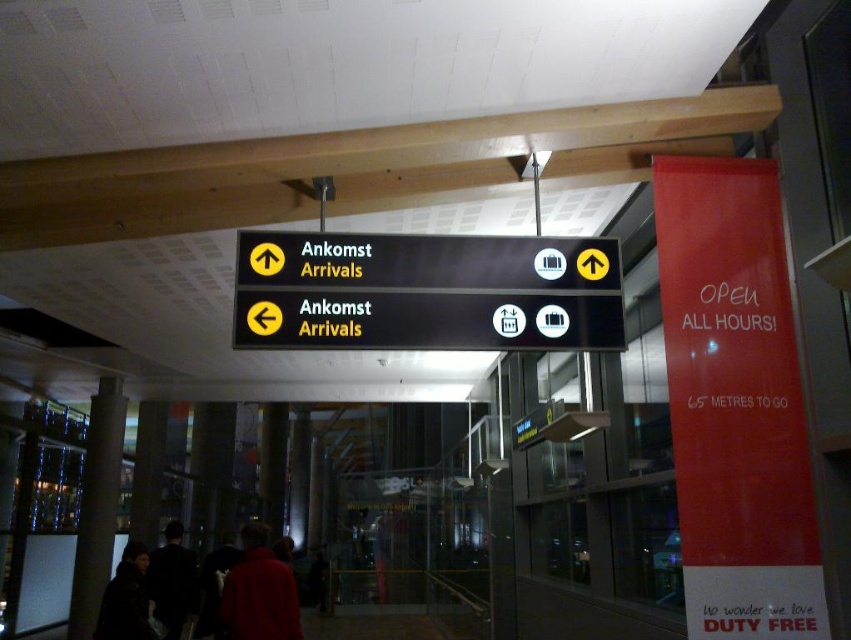
Question: Estimate the real-world distances between objects in this image. Which object is farther from the red fabric jacket at lower center?

Choices:
 (A) black matte sign at center
 (B) dark fabric jacket at center

Answer: (A)

Question: Which of the following is the closest to the observer?

Choices:
 (A) red fabric jacket at lower center
 (B) black matte sign at center
 (C) dark brown leather jacket at lower left

Answer: (B)

Question: Does red fabric jacket at lower center have a lesser width compared to dark brown leather jacket at lower left?

Choices:
 (A) yes
 (B) no

Answer: (B)

Question: Does black matte sign at center appear on the left side of red fabric jacket at lower center?

Choices:
 (A) yes
 (B) no

Answer: (B)

Question: Which object appears closest to the camera in this image?

Choices:
 (A) dark fabric jacket at center
 (B) dark brown leather jacket at lower left
 (C) red fabric jacket at lower center
 (D) black matte sign at center

Answer: (D)

Question: Can you confirm if red fabric jacket at lower center is positioned to the left of dark fabric jacket at center?

Choices:
 (A) yes
 (B) no

Answer: (B)